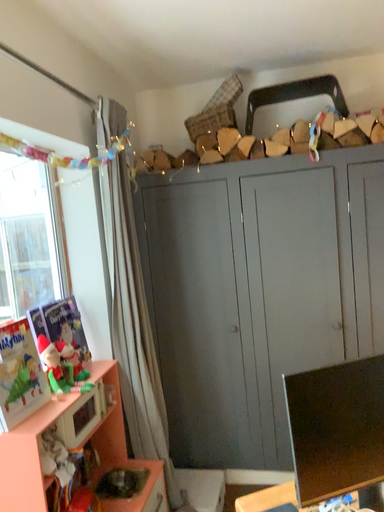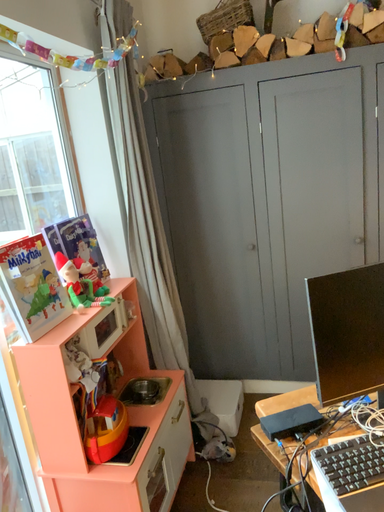
Question: How did the camera likely rotate when shooting the video?

Choices:
 (A) rotated upward
 (B) rotated downward

Answer: (B)